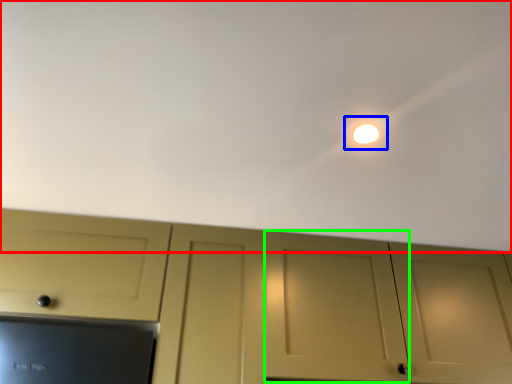
Question: Based on their relative distances, which object is farther from backdrop (highlighted by a red box)? Choose from light (highlighted by a blue box) and door (highlighted by a green box).

Choices:
 (A) light
 (B) door

Answer: (B)